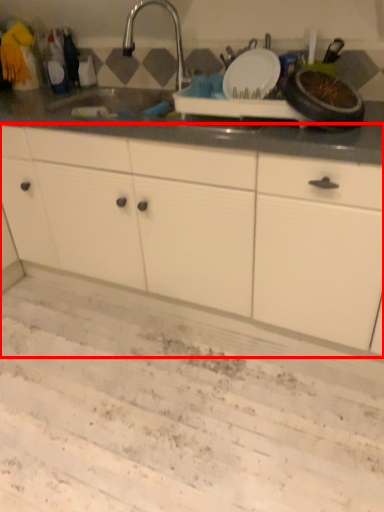
Question: From the image's perspective, what is the correct spatial relationship of cabinetry (annotated by the red box) in relation to tap?

Choices:
 (A) below
 (B) above

Answer: (A)